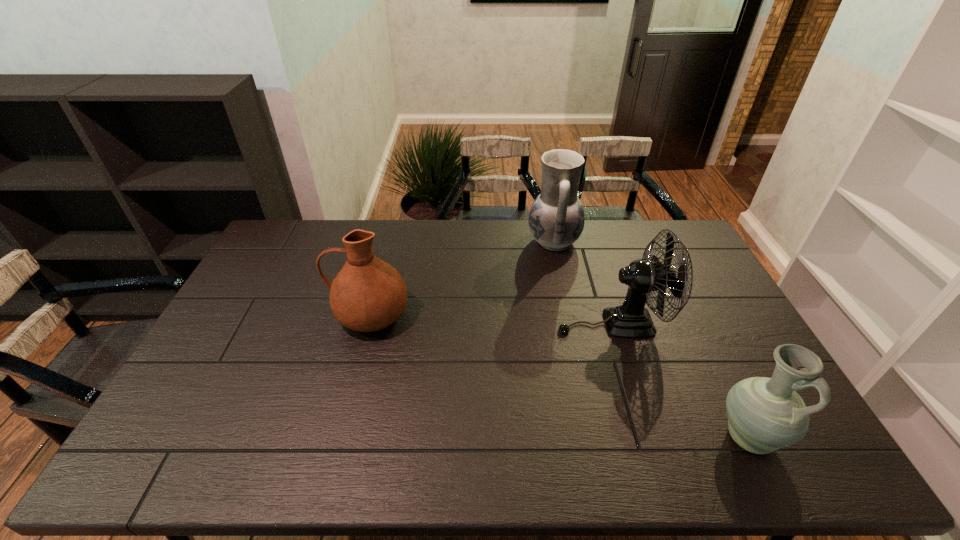
Identify the location of the farthest object. (556, 219).

Locate an element on the screen. The image size is (960, 540). the farthest pitcher is located at coordinates (556, 219).

Identify the location of fan. The height and width of the screenshot is (540, 960). (632, 320).

At what (x,y) coordinates should I click in order to perform the action: click on the leftmost pitcher. Please return your answer as a coordinate pair (x, y). Looking at the image, I should click on (367, 294).

At what (x,y) coordinates should I click in order to perform the action: click on the second farthest pitcher. Please return your answer as a coordinate pair (x, y). The image size is (960, 540). Looking at the image, I should click on (367, 294).

Where is `the nearest object`? Image resolution: width=960 pixels, height=540 pixels. the nearest object is located at coordinates (765, 414).

The image size is (960, 540). Find the location of `the rightmost pitcher`. the rightmost pitcher is located at coordinates (765, 414).

This screenshot has width=960, height=540. I want to click on free spot located on the front-facing side of the second pitcher from left to right, so click(451, 241).

This screenshot has height=540, width=960. Find the location of `free space located on the front-facing side of the second pitcher from left to right`. free space located on the front-facing side of the second pitcher from left to right is located at coordinates (514, 241).

The image size is (960, 540). Find the location of `free location located 0.170m on the front-facing side of the second pitcher from left to right`. free location located 0.170m on the front-facing side of the second pitcher from left to right is located at coordinates (482, 241).